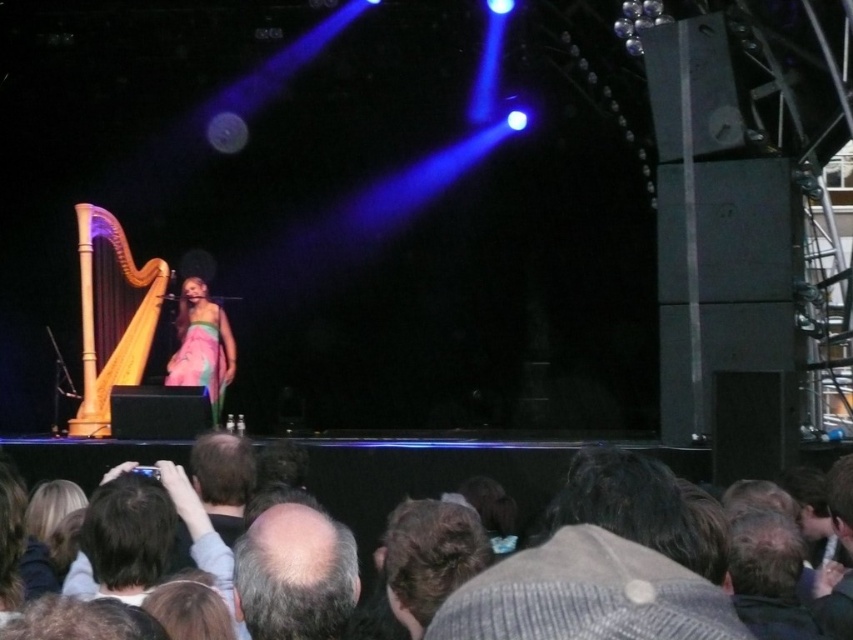
Question: Which object is farther from the camera taking this photo?

Choices:
 (A) natural wood harp at left
 (B) pastel silk dress at center
 (C) pastel chiffon dress at center

Answer: (C)

Question: In this image, where is dark brown hair at lower center located relative to natural wood harp at left?

Choices:
 (A) right
 (B) left

Answer: (A)

Question: Does dark brown hair at lower center appear under natural wood harp at left?

Choices:
 (A) no
 (B) yes

Answer: (B)

Question: Is dark brown hair at lower center bigger than natural wood harp at left?

Choices:
 (A) no
 (B) yes

Answer: (B)

Question: Based on their relative distances, which object is nearer to the pastel silk dress at center?

Choices:
 (A) bald head at center
 (B) dark brown hair at lower center
 (C) pastel chiffon dress at center

Answer: (C)

Question: Which point appears farthest from the camera in this image?

Choices:
 (A) (375, 474)
 (B) (300, 524)
 (C) (225, 352)
 (D) (223, 392)

Answer: (D)